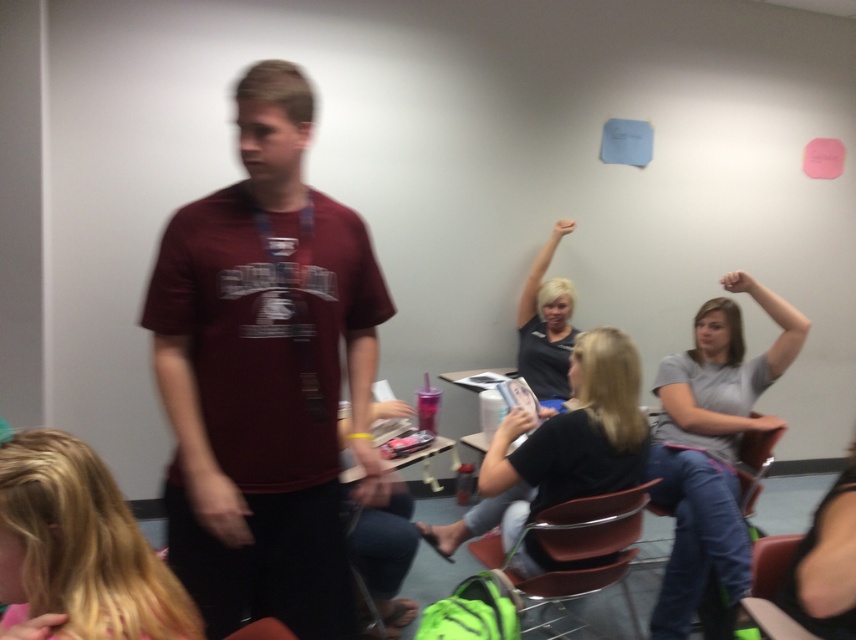
You are a photographer trying to adjust the lighting in this image. You notice the gray matte shirt at lower right and the black matte shirt at center. Which shirt is positioned higher in the frame?

The gray matte shirt at lower right is located above the black matte shirt at center, so it is positioned higher in the frame.